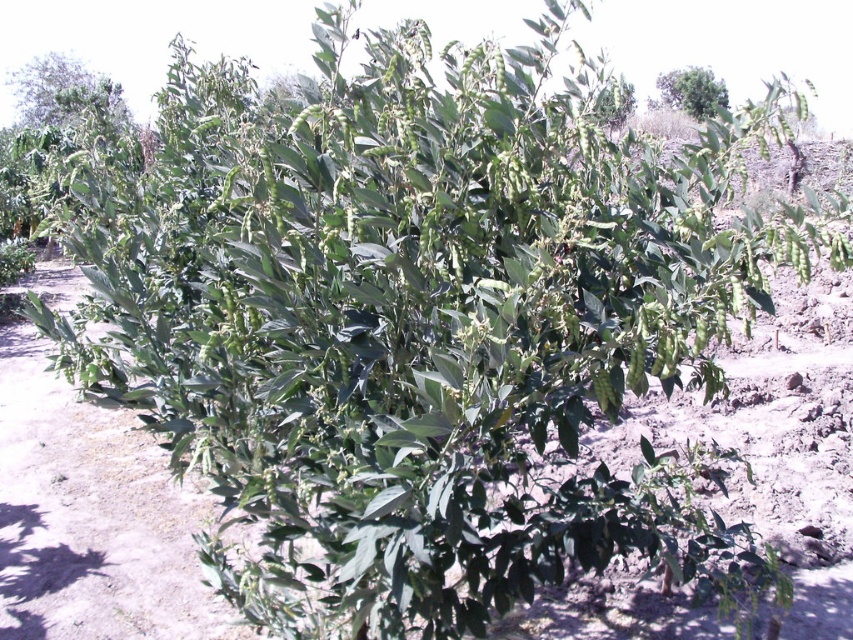
Question: Which point is farther to the camera?

Choices:
 (A) green leafy tree at upper center
 (B) green leafy plant at upper left

Answer: (B)

Question: Does green leafy plant at upper left have a smaller size compared to green leafy tree at upper center?

Choices:
 (A) yes
 (B) no

Answer: (A)

Question: Can you confirm if green leafy plant at upper left is positioned to the right of green leafy tree at upper center?

Choices:
 (A) yes
 (B) no

Answer: (B)

Question: In this image, where is green leafy plant at upper left located relative to green leafy tree at upper center?

Choices:
 (A) above
 (B) below

Answer: (A)